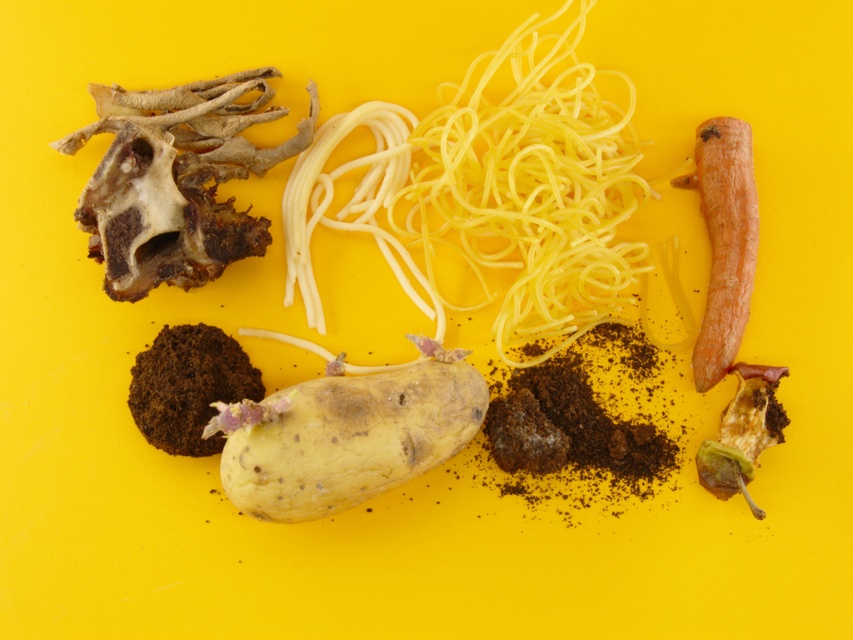
Does point (570, 129) come behind point (711, 451)?

Yes.

Does point (445, 122) come in front of point (767, 376)?

That is False.

In order to click on yellow matte spaghetti at center in this screenshot , I will do `click(497, 186)`.

Who is shorter, speckled yellow potato at center or rotten yellow potato at center?

Result: With less height is rotten yellow potato at center.

Does speckled yellow potato at center appear over rotten yellow potato at center?

No.

Is point (440, 362) closer to camera compared to point (733, 454)?

No.

Identify the location of speckled yellow potato at center. (344, 436).

Between brown crumbly soil at center-left and rotten yellow potato at center, which one has more height?

With more height is rotten yellow potato at center.

I want to click on brown crumbly soil at center-left, so (x=189, y=387).

Find the location of a particular element. This screenshot has width=853, height=640. brown crumbly soil at center-left is located at coordinates (189, 387).